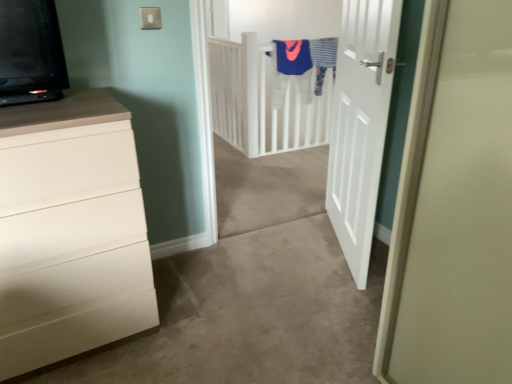
In order to face white plastic electric outlet at upper center, should I rotate leftwards or rightwards?

It's best to rotate left around 13.637 degrees.

The image size is (512, 384). I want to click on blue fabric robe at upper center, so (292, 70).

I want to click on striped fabric at upper center, so click(323, 59).

Is white matte chest of drawers at left far away from white matte door at center?

Yes, white matte chest of drawers at left and white matte door at center are quite far apart.

Is white matte chest of drawers at left not within white matte door at center?

Yes, white matte chest of drawers at left is not within white matte door at center.

Is point (130, 313) positioned after point (337, 95)?

No, (130, 313) is closer to viewer.

From the image's perspective, would you say white matte chest of drawers at left is shown under white matte door at center?

Yes, from the image's perspective, white matte chest of drawers at left is beneath white matte door at center.

From a real-world perspective, which object rests below the other?

From a 3D spatial view, white matte door at center is below.

Between point (327, 40) and point (370, 240), which one is positioned in front?

The point (370, 240) is closer.

Is striped fabric at upper center turned away from white matte door at center?

That's not correct — striped fabric at upper center is not looking away from white matte door at center.

Which object is thinner, blue fabric robe at upper center or striped fabric at upper center?

With smaller width is blue fabric robe at upper center.

Between blue fabric robe at upper center and striped fabric at upper center, which one is positioned in front?

blue fabric robe at upper center is in front.

Considering the relative positions of blue fabric robe at upper center and striped fabric at upper center in the image provided, is blue fabric robe at upper center to the right of striped fabric at upper center from the viewer's perspective?

No.

Can you confirm if striped fabric at upper center is taller than blue fabric robe at upper center?

Yes.

Between point (334, 61) and point (280, 77), which one is positioned in front?

The point (334, 61) is closer.

From the image's perspective, which object appears higher, striped fabric at upper center or blue fabric robe at upper center?

blue fabric robe at upper center.

Is striped fabric at upper center beside blue fabric robe at upper center?

striped fabric at upper center and blue fabric robe at upper center are not in contact.

Which is behind, point (60, 265) or point (146, 18)?

The point (146, 18) is behind.

Is white matte chest of drawers at left not within white plastic electric outlet at upper center?

Indeed, white matte chest of drawers at left is completely outside white plastic electric outlet at upper center.

Locate an element on the screen. electric outlet that is behind the white matte chest of drawers at left is located at coordinates (150, 18).

Is white matte chest of drawers at left next to white plastic electric outlet at upper center and touching it?

No, white matte chest of drawers at left is not with white plastic electric outlet at upper center.

What's the angular difference between blue fabric robe at upper center and white plastic electric outlet at upper center's facing directions?

The angular difference between blue fabric robe at upper center and white plastic electric outlet at upper center is 2.19 degrees.

Is point (282, 74) farther from camera compared to point (141, 28)?

Yes, it is behind point (141, 28).

From a real-world perspective, between blue fabric robe at upper center and white plastic electric outlet at upper center, who is vertically lower?

blue fabric robe at upper center.

Is blue fabric robe at upper center thinner than white plastic electric outlet at upper center?

In fact, blue fabric robe at upper center might be wider than white plastic electric outlet at upper center.

From the image's perspective, which object appears higher, white matte chest of drawers at left or striped fabric at upper center?

striped fabric at upper center is shown above in the image.

Can you tell me how much white matte chest of drawers at left and striped fabric at upper center differ in facing direction?

white matte chest of drawers at left and striped fabric at upper center are facing 1.41 degrees away from each other.

You are a GUI agent. You are given a task and a screenshot of the screen. Output one action in this format:
    pyautogui.click(x=<x>, y=<y>)
    Task: Click on the laundry on the right side of white matte chest of drawers at left
    The width and height of the screenshot is (512, 384).
    Given the screenshot: What is the action you would take?
    pyautogui.click(x=323, y=59)

Is white matte chest of drawers at left to the left of striped fabric at upper center from the viewer's perspective?

Yes, white matte chest of drawers at left is to the left of striped fabric at upper center.

The height and width of the screenshot is (384, 512). I want to click on door behind the white matte chest of drawers at left, so click(x=360, y=124).

Where is `laundry that appears above the white matte door at center (from a real-world perspective)`? The height and width of the screenshot is (384, 512). laundry that appears above the white matte door at center (from a real-world perspective) is located at coordinates (323, 59).

Looking at the image, which one is located closer to striped fabric at upper center, white plastic electric outlet at upper center or white matte chest of drawers at left?

white plastic electric outlet at upper center is positioned closer to the anchor striped fabric at upper center.

Estimate the real-world distances between objects in this image. Which object is closer to striped fabric at upper center, white plastic electric outlet at upper center or blue fabric robe at upper center?

The object closer to striped fabric at upper center is blue fabric robe at upper center.

Which object lies further to the anchor point striped fabric at upper center, blue fabric robe at upper center or white matte door at center?

white matte door at center.

Considering their positions, is striped fabric at upper center positioned closer to white matte chest of drawers at left than white plastic electric outlet at upper center?

Based on the image, white plastic electric outlet at upper center appears to be nearer to white matte chest of drawers at left.

From the image, which object appears to be nearer to striped fabric at upper center, white matte door at center or blue fabric robe at upper center?

blue fabric robe at upper center is positioned closer to the anchor striped fabric at upper center.

When comparing their distances from white matte door at center, does striped fabric at upper center or white plastic electric outlet at upper center seem closer?

The object closer to white matte door at center is white plastic electric outlet at upper center.

Considering their positions, is striped fabric at upper center positioned further to white matte chest of drawers at left than blue fabric robe at upper center?

striped fabric at upper center is positioned further to the anchor white matte chest of drawers at left.

Based on their spatial positions, is white matte door at center or white plastic electric outlet at upper center further from striped fabric at upper center?

white plastic electric outlet at upper center is positioned further to the anchor striped fabric at upper center.

Locate an element on the screen. robe between white plastic electric outlet at upper center and striped fabric at upper center along the z-axis is located at coordinates click(x=292, y=70).

The height and width of the screenshot is (384, 512). Find the location of `electric outlet located between white matte chest of drawers at left and white matte door at center in the left-right direction`. electric outlet located between white matte chest of drawers at left and white matte door at center in the left-right direction is located at coordinates (150, 18).

You are a GUI agent. You are given a task and a screenshot of the screen. Output one action in this format:
    pyautogui.click(x=<x>, y=<y>)
    Task: Click on the electric outlet between white matte chest of drawers at left and striped fabric at upper center from front to back
    
    Given the screenshot: What is the action you would take?
    pyautogui.click(x=150, y=18)

At what (x,y) coordinates should I click in order to perform the action: click on electric outlet positioned between white matte door at center and striped fabric at upper center from near to far. Please return your answer as a coordinate pair (x, y). Image resolution: width=512 pixels, height=384 pixels. Looking at the image, I should click on (150, 18).